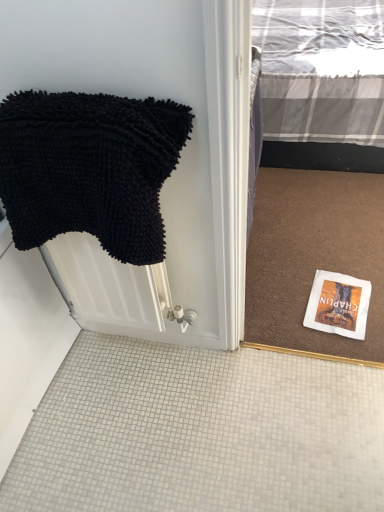
Where is `empty space that is ontop of black chenille towel at left`? empty space that is ontop of black chenille towel at left is located at coordinates (71, 106).